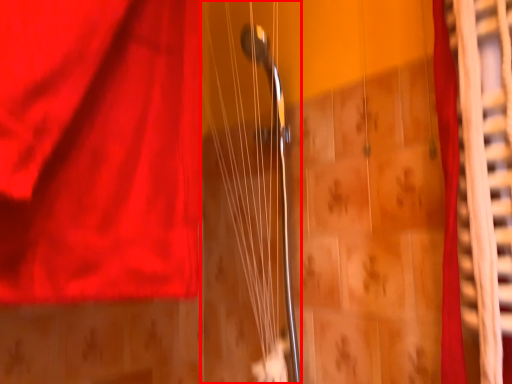
Question: Observing the image, what is the correct spatial positioning of string (annotated by the red box) in reference to curtain?

Choices:
 (A) right
 (B) left

Answer: (B)